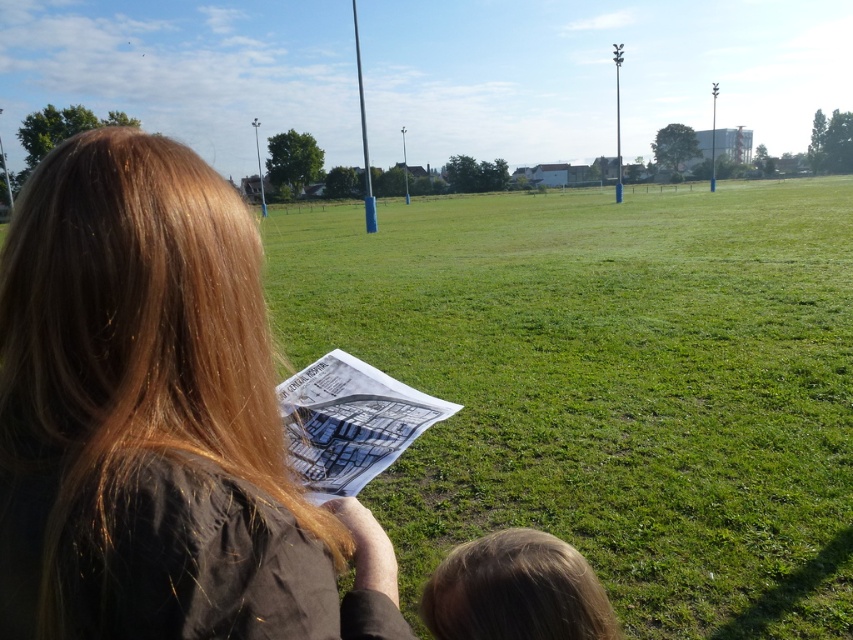
You are a photographer trying to capture a group photo of two people in the scene. The first person has brown hair at left, and the second has blonde hair at lower center. You want to frame both in a way that their hair widths are proportionally represented. Which person should you position closer to the camera to ensure their hair width appears similar in the photo?

To make the brown hair at left and blonde hair at lower center appear similar in width in the photo, position the blonde hair at lower center closer to the camera. Since the brown hair at left is naturally wider, moving the narrower blonde hair closer will help balance their apparent widths.

You are a drone operator who needs to fly a drone from the green grass field at center to the brown hair at left. What is the minimum distance you need to cover?

The minimum distance between the green grass field at center and the brown hair at left is 5.23 meters.